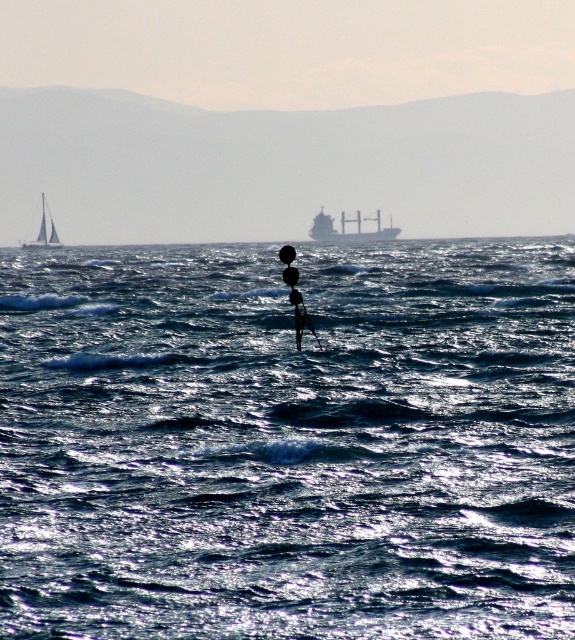
Is shiny blue water at center positioned behind white glossy sailboat at upper left?

No, it is not.

Based on the photo, can you confirm if shiny blue water at center is positioned to the right of white glossy sailboat at upper left?

Correct, you'll find shiny blue water at center to the right of white glossy sailboat at upper left.

Who is more distant from viewer, (154,348) or (25,243)?

Point (25,243)

The image size is (575, 640). In order to click on shiny blue water at center in this screenshot , I will do `click(288, 442)`.

Who is more distant from viewer, [378,218] or [297,342]?

Point [378,218]

Which is in front, point (339, 241) or point (300, 321)?

Point (300, 321) is in front.

Does point (346, 218) come farther from viewer compared to point (310, 324)?

Yes.

In order to click on metallic gray cargo ship at center in this screenshot , I will do `click(345, 228)`.

Does shiny blue water at center lie in front of smooth glass ocean at center?

Yes, shiny blue water at center is in front of smooth glass ocean at center.

Which is behind, point (208, 320) or point (493, 209)?

The point (493, 209) is behind.

Between point (377, 253) and point (569, 136), which one is positioned behind?

The point (569, 136) is more distant.

Identify the location of shiny blue water at center. The height and width of the screenshot is (640, 575). (288, 442).